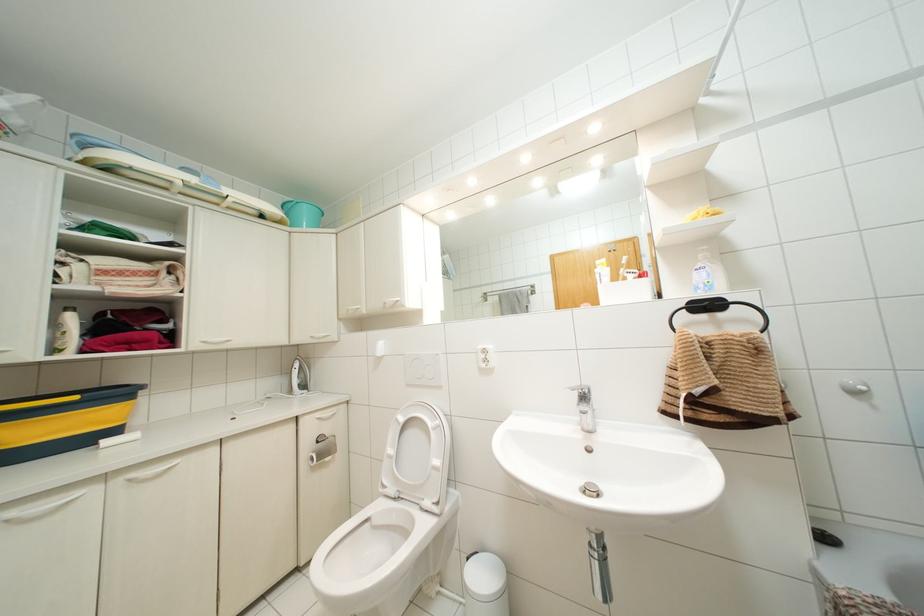
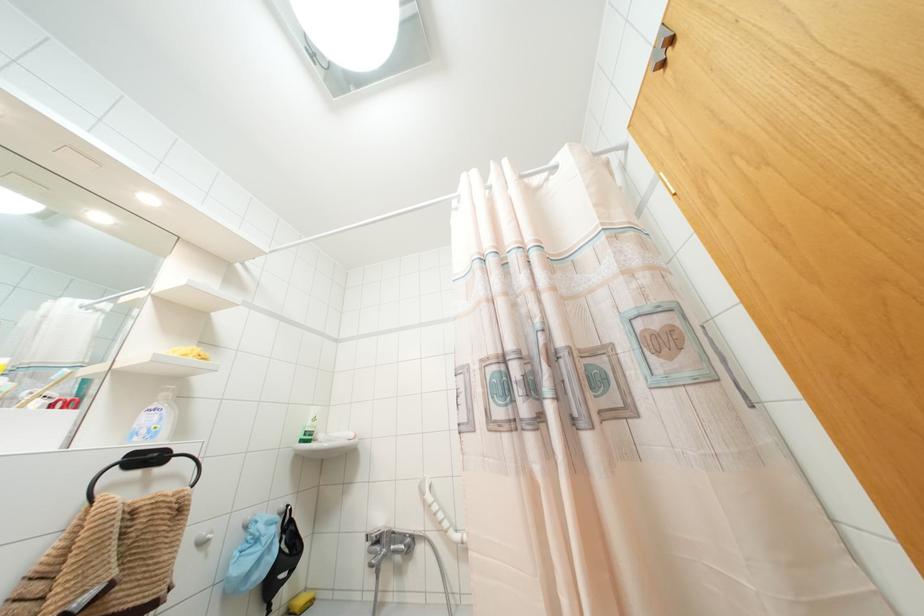
In the scene shown: Based on the continuous images, in which direction is the camera rotating?

The camera rotated toward right-up.